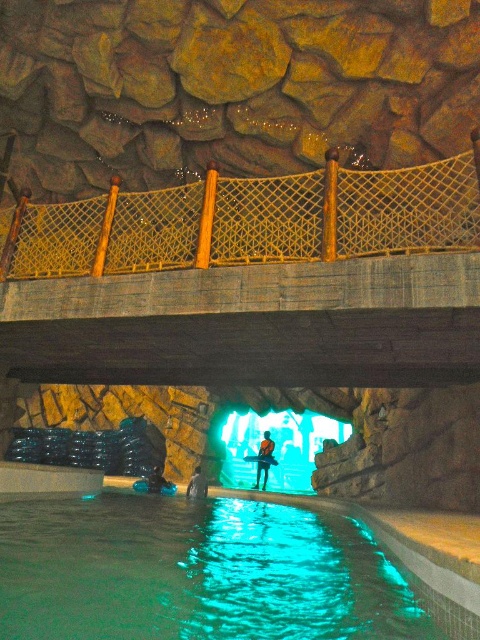
Between point (110, 547) and point (300, 460), which one is positioned in front?

Positioned in front is point (110, 547).

Which is in front, point (261, 634) or point (214, 444)?

Positioned in front is point (261, 634).

Image resolution: width=480 pixels, height=640 pixels. In order to click on clear plastic pool at lower center in this screenshot , I will do `click(203, 573)`.

Does yellow mesh rope bridge at upper center appear on the right side of translucent glass cave at center?

No, yellow mesh rope bridge at upper center is not to the right of translucent glass cave at center.

Is point (315, 323) farther from viewer compared to point (268, 429)?

No, it is in front of (268, 429).

Find the location of `yellow mesh rope bridge at upper center`. yellow mesh rope bridge at upper center is located at coordinates (240, 296).

Is yellow mesh rope bridge at upper center positioned behind blue rubber boots at lower center?

No.

Which of these two, yellow mesh rope bridge at upper center or blue rubber boots at lower center, stands taller?

blue rubber boots at lower center is taller.

Who is more distant from viewer, (259, 227) or (202, 493)?

The point (202, 493) is more distant.

What are the coordinates of `yellow mesh rope bridge at upper center` in the screenshot? It's located at (240, 296).